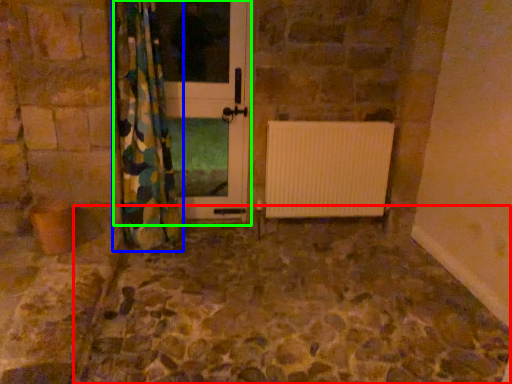
Question: Based on their relative distances, which object is farther from path (highlighted by a red box)? Choose from curtain (highlighted by a blue box) and screen door (highlighted by a green box).

Choices:
 (A) curtain
 (B) screen door

Answer: (B)